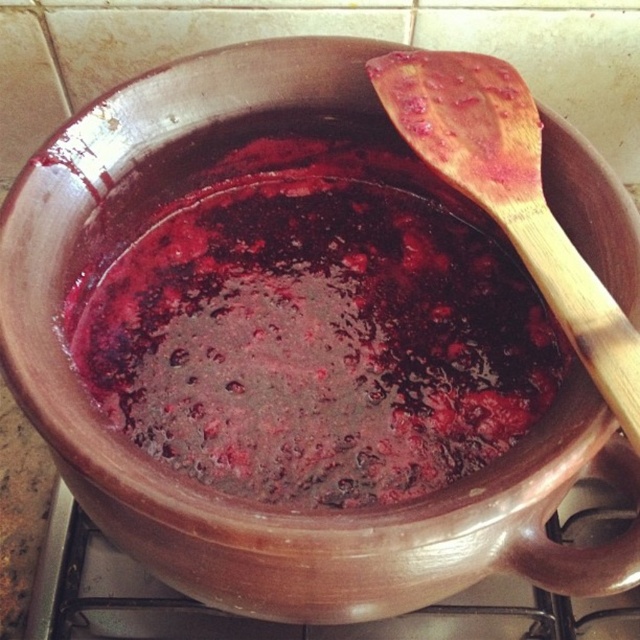
Question: Is shiny dark red jam at center wider than wooden spoon at upper right?

Choices:
 (A) no
 (B) yes

Answer: (B)

Question: Which object is farther from the camera taking this photo?

Choices:
 (A) wooden spoon at upper right
 (B) shiny dark red jam at center

Answer: (B)

Question: Which point is closer to the camera?

Choices:
 (A) (483, 406)
 (B) (548, 257)

Answer: (B)

Question: Does shiny dark red jam at center lie behind wooden spoon at upper right?

Choices:
 (A) no
 (B) yes

Answer: (B)

Question: Among these points, which one is farthest from the camera?

Choices:
 (A) (616, 360)
 (B) (179, 397)

Answer: (B)

Question: Is shiny dark red jam at center further to the viewer compared to wooden spoon at upper right?

Choices:
 (A) yes
 (B) no

Answer: (A)